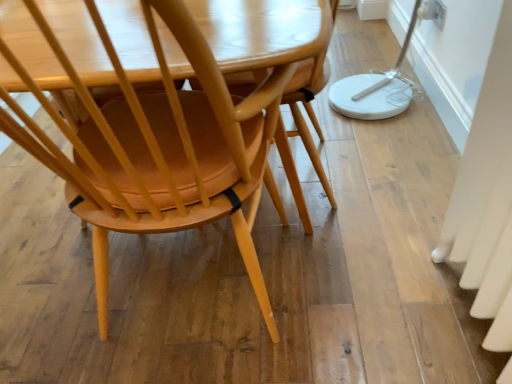
I want to click on unoccupied region to the right of matte wood chair at center, so click(374, 249).